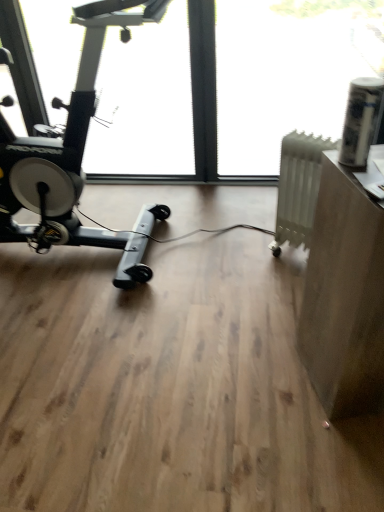
Image resolution: width=384 pixels, height=512 pixels. In order to click on transparent plastic window screen at upper right, which appears as the 1th window screen when viewed from the right in this screenshot , I will do `click(284, 75)`.

At what (x,y) coordinates should I click in order to perform the action: click on matte brown desk at right. Please return your answer as a coordinate pair (x, y). Looking at the image, I should click on (344, 296).

You are a GUI agent. You are given a task and a screenshot of the screen. Output one action in this format:
    pyautogui.click(x=<x>, y=<y>)
    Task: Click on the white matte radiator at right
    
    Given the screenshot: What is the action you would take?
    pyautogui.click(x=298, y=188)

Based on the photo, is transparent glass window at center, the 2th window screen when ordered from right to left, facing towards transparent plastic window screen at upper right, which appears as the 1th window screen when viewed from the right?

No, transparent glass window at center, the 2th window screen when ordered from right to left, is not oriented towards transparent plastic window screen at upper right, which appears as the 1th window screen when viewed from the right.

Is point (108, 82) farther from viewer compared to point (255, 144)?

No, it is not.

What's the angular difference between transparent glass window at center, the 2th window screen when ordered from right to left, and transparent plastic window screen at upper right, the second window screen when ordered from left to right,'s facing directions?

The facing directions of transparent glass window at center, the 2th window screen when ordered from right to left, and transparent plastic window screen at upper right, the second window screen when ordered from left to right, are 0.00115 degrees apart.

Considering the relative sizes of transparent glass window at center, the 2th window screen when ordered from right to left, and transparent plastic window screen at upper right, which appears as the 1th window screen when viewed from the right, in the image provided, is transparent glass window at center, the 2th window screen when ordered from right to left, thinner than transparent plastic window screen at upper right, which appears as the 1th window screen when viewed from the right,?

No.

Is transparent plastic window screen at upper right, which appears as the 1th window screen when viewed from the right, a part of white matte radiator at right?

No.

Locate an element on the screen. radiator on the left of transparent plastic window screen at upper right, the second window screen when ordered from left to right is located at coordinates [298, 188].

Which object is closer to the camera taking this photo, white matte radiator at right or transparent plastic window screen at upper right, the second window screen when ordered from left to right?

white matte radiator at right is closer to the camera.

Considering the relative sizes of white matte radiator at right and transparent plastic window screen at upper right, the second window screen when ordered from left to right, in the image provided, is white matte radiator at right smaller than transparent plastic window screen at upper right, the second window screen when ordered from left to right,?

Correct, white matte radiator at right occupies less space than transparent plastic window screen at upper right, the second window screen when ordered from left to right.

From a real-world perspective, which object rests below the other?

matte brown desk at right, from a real-world perspective.

Based on the photo, is transparent plastic window screen at upper right, the second window screen when ordered from left to right, shorter than matte brown desk at right?

In fact, transparent plastic window screen at upper right, the second window screen when ordered from left to right, may be taller than matte brown desk at right.

Is transparent plastic window screen at upper right, which appears as the 1th window screen when viewed from the right, in front of or behind matte brown desk at right in the image?

transparent plastic window screen at upper right, which appears as the 1th window screen when viewed from the right, is behind matte brown desk at right.

Is white matte radiator at right next to matte brown desk at right?

No, white matte radiator at right is not next to matte brown desk at right.

Is white matte radiator at right to the left of matte brown desk at right from the viewer's perspective?

Indeed, white matte radiator at right is positioned on the left side of matte brown desk at right.

Is white matte radiator at right located outside matte brown desk at right?

white matte radiator at right lies outside matte brown desk at right's area.

In terms of height, does white matte radiator at right look taller or shorter compared to matte brown desk at right?

Considering their sizes, white matte radiator at right has less height than matte brown desk at right.

Which is more to the left, transparent glass window at center, which is the first window screen from left to right, or white matte radiator at right?

From the viewer's perspective, transparent glass window at center, which is the first window screen from left to right, appears more on the left side.

From the picture: What's the angular difference between transparent glass window at center, the 2th window screen when ordered from right to left, and white matte radiator at right's facing directions?

transparent glass window at center, the 2th window screen when ordered from right to left, and white matte radiator at right are facing 32.1 degrees away from each other.

Identify the location of radiator on the right of transparent glass window at center, which is the first window screen from left to right. (298, 188).

Is transparent plastic window screen at upper right, the second window screen when ordered from left to right, smaller than white matte radiator at right?

Actually, transparent plastic window screen at upper right, the second window screen when ordered from left to right, might be larger than white matte radiator at right.

From a real-world perspective, relative to white matte radiator at right, is transparent plastic window screen at upper right, which appears as the 1th window screen when viewed from the right, vertically above or below?

transparent plastic window screen at upper right, which appears as the 1th window screen when viewed from the right, is situated higher than white matte radiator at right in the real world.

Which is more distant, (x=291, y=56) or (x=309, y=216)?

Positioned behind is point (x=291, y=56).

Between white matte radiator at right and transparent glass window at center, the 2th window screen when ordered from right to left, which one has smaller size?

white matte radiator at right is smaller.

Is the surface of white matte radiator at right in direct contact with transparent glass window at center, which is the first window screen from left to right?

No, white matte radiator at right is not beside transparent glass window at center, which is the first window screen from left to right.

Could you tell me if white matte radiator at right is facing transparent glass window at center, the 2th window screen when ordered from right to left?

Yes, white matte radiator at right faces towards transparent glass window at center, the 2th window screen when ordered from right to left.

From a real-world perspective, is white matte radiator at right physically located above or below transparent glass window at center, the 2th window screen when ordered from right to left?

Clearly, from a real-world perspective, white matte radiator at right is below transparent glass window at center, the 2th window screen when ordered from right to left.

Where is `window screen below the transparent plastic window screen at upper right, which appears as the 1th window screen when viewed from the right (from the image's perspective)`? window screen below the transparent plastic window screen at upper right, which appears as the 1th window screen when viewed from the right (from the image's perspective) is located at coordinates tap(223, 89).

From a real-world perspective, which window screen is the 1st one above the white matte radiator at right? Please provide its 2D coordinates.

[(284, 75)]

Which object lies further to the anchor point transparent plastic window screen at upper right, the second window screen when ordered from left to right, white matte radiator at right or transparent glass window at center, the 2th window screen when ordered from right to left?

Among the two, white matte radiator at right is located further to transparent plastic window screen at upper right, the second window screen when ordered from left to right.

From the image, which object appears to be nearer to matte brown desk at right, transparent glass window at center, which is the first window screen from left to right, or transparent plastic window screen at upper right, the second window screen when ordered from left to right?

The object closer to matte brown desk at right is transparent glass window at center, which is the first window screen from left to right.

Which object lies nearer to the anchor point transparent plastic window screen at upper right, which appears as the 1th window screen when viewed from the right, matte brown desk at right or transparent glass window at center, which is the first window screen from left to right?

Among the two, transparent glass window at center, which is the first window screen from left to right, is located nearer to transparent plastic window screen at upper right, which appears as the 1th window screen when viewed from the right.

Which object lies nearer to the anchor point matte brown desk at right, transparent glass window at center, which is the first window screen from left to right, or white matte radiator at right?

white matte radiator at right lies closer to matte brown desk at right than the other object.

Based on their spatial positions, is matte brown desk at right or transparent plastic window screen at upper right, the second window screen when ordered from left to right, further from transparent glass window at center, which is the first window screen from left to right?

matte brown desk at right lies further to transparent glass window at center, which is the first window screen from left to right, than the other object.

From the image, which object appears to be farther from white matte radiator at right, transparent glass window at center, the 2th window screen when ordered from right to left, or transparent plastic window screen at upper right, the second window screen when ordered from left to right?

transparent glass window at center, the 2th window screen when ordered from right to left, is further to white matte radiator at right.

Estimate the real-world distances between objects in this image. Which object is closer to transparent plastic window screen at upper right, which appears as the 1th window screen when viewed from the right, matte brown desk at right or white matte radiator at right?

Based on the image, white matte radiator at right appears to be nearer to transparent plastic window screen at upper right, which appears as the 1th window screen when viewed from the right.

Looking at the image, which one is located further to white matte radiator at right, transparent plastic window screen at upper right, which appears as the 1th window screen when viewed from the right, or matte brown desk at right?

transparent plastic window screen at upper right, which appears as the 1th window screen when viewed from the right, lies further to white matte radiator at right than the other object.

You are a GUI agent. You are given a task and a screenshot of the screen. Output one action in this format:
    pyautogui.click(x=<x>, y=<y>)
    Task: Click on the window screen positioned between matte brown desk at right and transparent plastic window screen at upper right, which appears as the 1th window screen when viewed from the right, from near to far
    The width and height of the screenshot is (384, 512).
    Given the screenshot: What is the action you would take?
    pyautogui.click(x=223, y=89)

The image size is (384, 512). In order to click on radiator between transparent glass window at center, the 2th window screen when ordered from right to left, and matte brown desk at right, in the horizontal direction in this screenshot , I will do `click(298, 188)`.

The image size is (384, 512). I want to click on radiator between matte brown desk at right and transparent plastic window screen at upper right, which appears as the 1th window screen when viewed from the right, along the z-axis, so [x=298, y=188].

Locate an element on the screen. This screenshot has width=384, height=512. radiator between transparent glass window at center, which is the first window screen from left to right, and transparent plastic window screen at upper right, which appears as the 1th window screen when viewed from the right, along the z-axis is located at coordinates (298, 188).